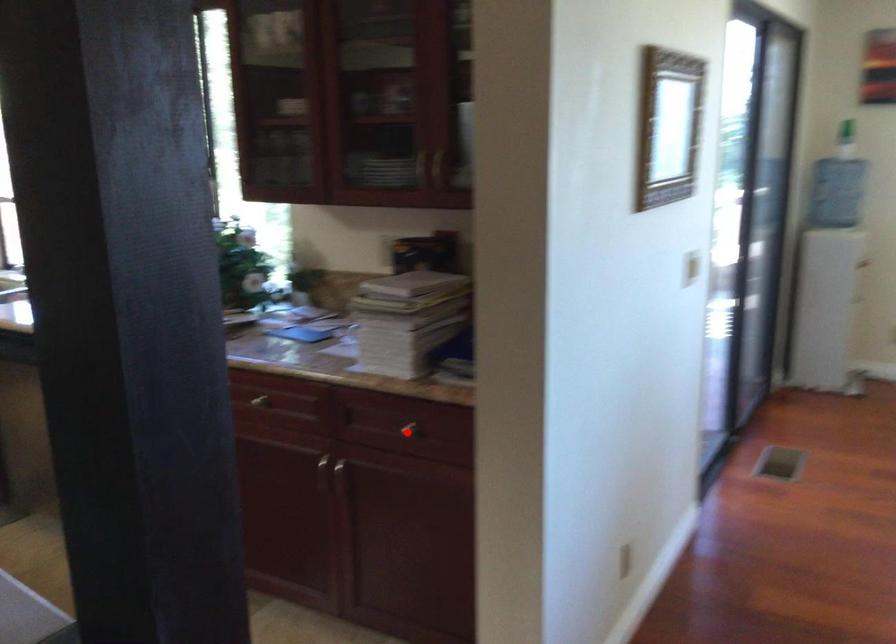
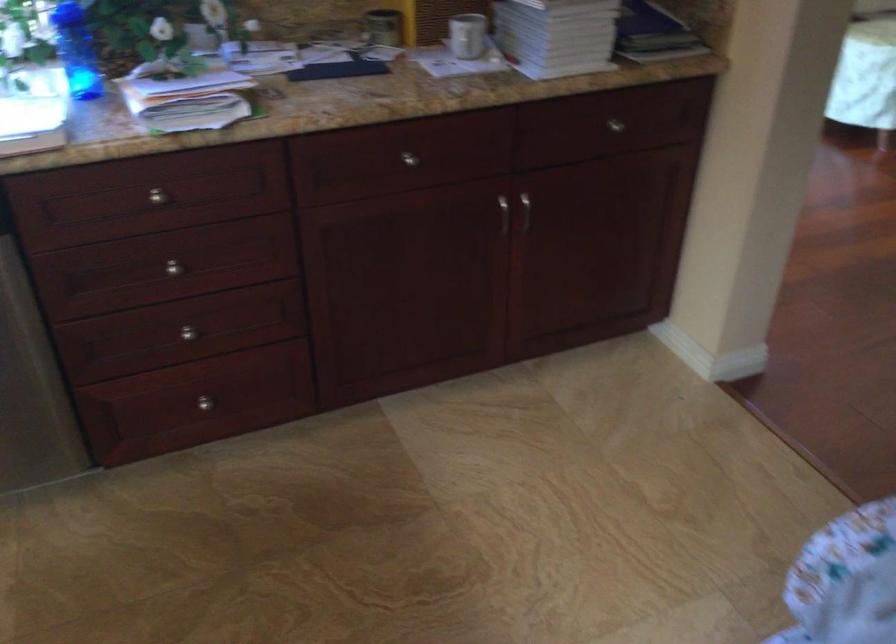
Question: A red point is marked in image1. In image2, is the corresponding 3D point closer to the camera or farther? Reply with the corresponding letter.

Choices:
 (A) The corresponding 3D point is closer.
 (B) The corresponding 3D point is farther.

Answer: (A)